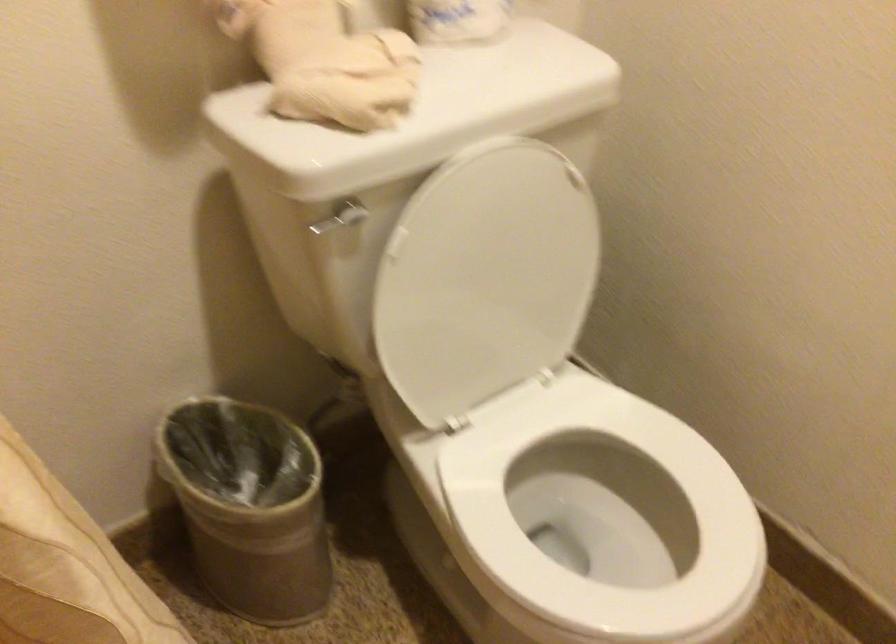
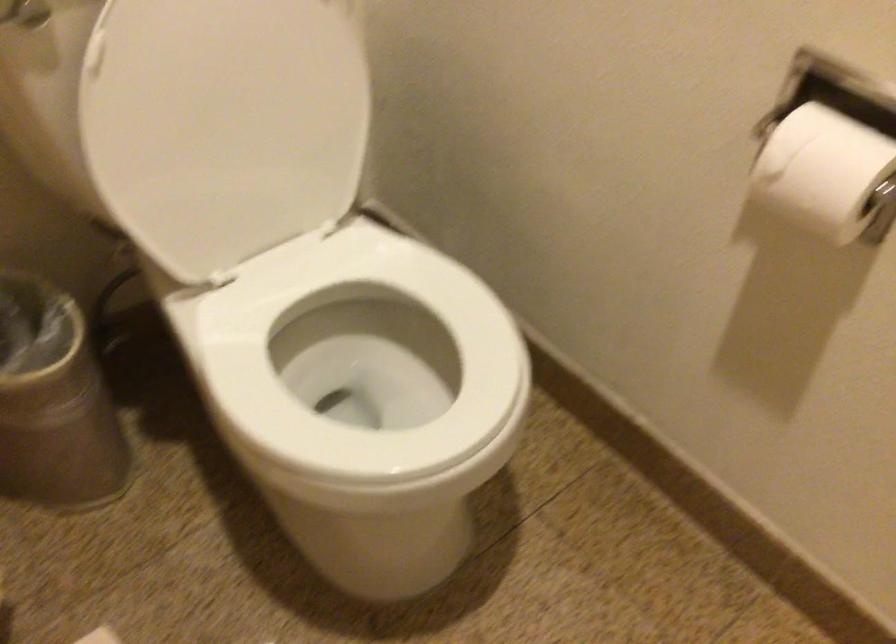
Find the pixel in the second image that matches pixel 289 534 in the first image.

(54, 402)